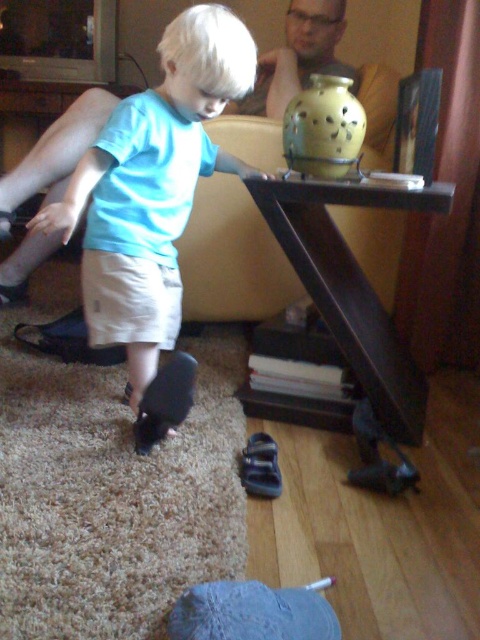
You are a delivery person entering the living room and need to place a package on the yellow matte vase at upper center without knocking it over. Is the matte black shoe at lower left in the way of placing the package?

The matte black shoe at lower left is below the yellow matte vase at upper center, so it is not blocking the area directly under the vase. However, since the shoe is positioned lower, it might still be in the path if you approach from the front. To safely place the package, ensure you position it on the shelf or surface where the yellow matte vase at upper center is located, avoiding the area near the matte black shoe at lower left.

You are a delivery person who needs to place a small package on the yellow matte vase at upper center without moving the matte black shoe at lower left. Is the space around the vase sufficient to place the package?

The matte black shoe at lower left is larger than the yellow matte vase at upper center, so placing a small package on the vase might be possible if the shoe doesn